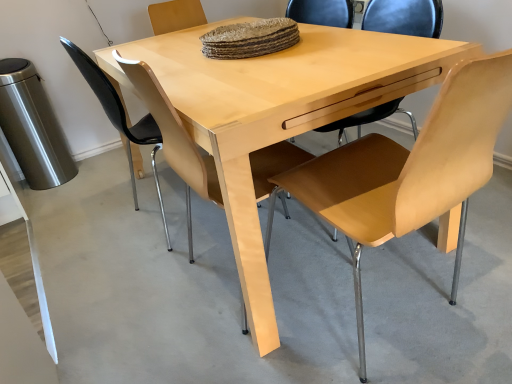
Where is `free space to the left of light brown leather chair at center, the 3th chair viewed from the right`? free space to the left of light brown leather chair at center, the 3th chair viewed from the right is located at coordinates (89, 234).